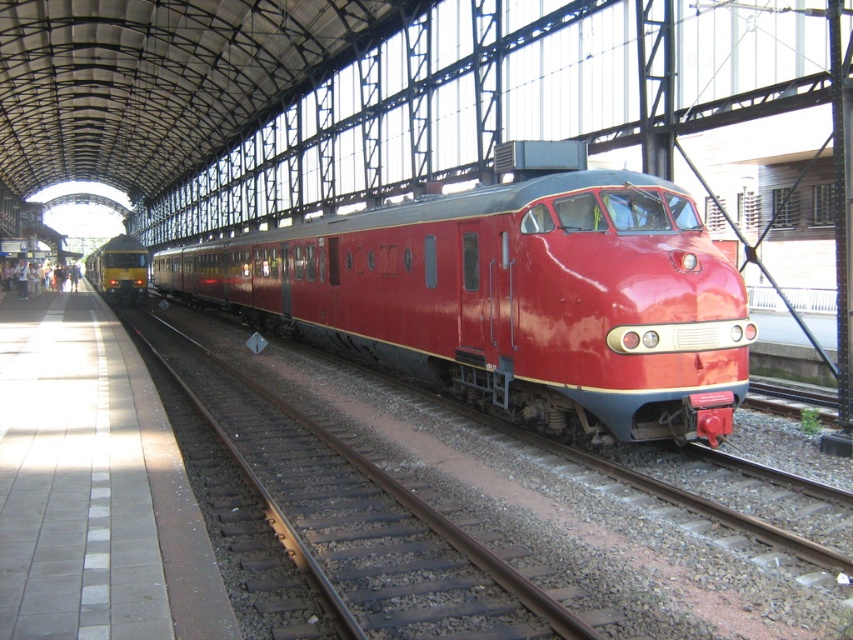
You are a passenger waiting at the train station. You see the glossy red train at center and the metallic yellow train at left. Which train is directly above the other?

The glossy red train at center is positioned under the metallic yellow train at left, so the metallic yellow train at left is directly above the glossy red train at center.

You are standing at the entrance of the train station and want to board the glossy red train at center. According to the coordinates provided, is the train positioned closer to the front or the back of the platform?

The glossy red train at center is located at point coordinates of 0.469 on the x and 0.599 on the y. Since the coordinates are based on a scale from 0 to 1, the train is positioned closer to the back of the platform because the y coordinate is closer to 1, which typically represents the back end in such coordinate systems.